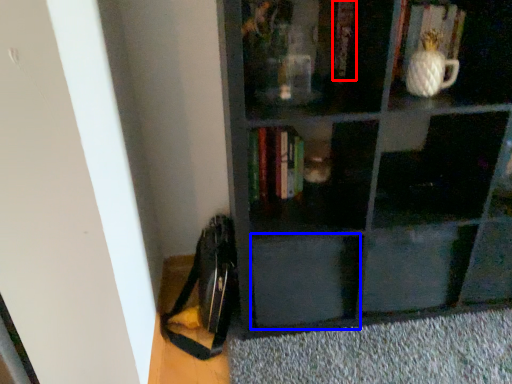
Question: Which object is further to the camera taking this photo, book (highlighted by a red box) or drawer (highlighted by a blue box)?

Choices:
 (A) book
 (B) drawer

Answer: (B)